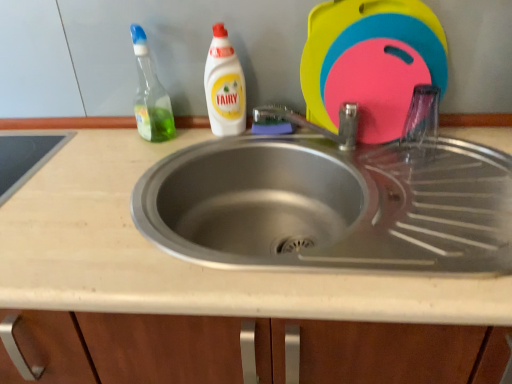
Locate an element on the screen. Image resolution: width=512 pixels, height=384 pixels. vacant space that is to the left of white plastic bottle at upper center, positioned as the 1th cleaning product in right-to-left order is located at coordinates (161, 144).